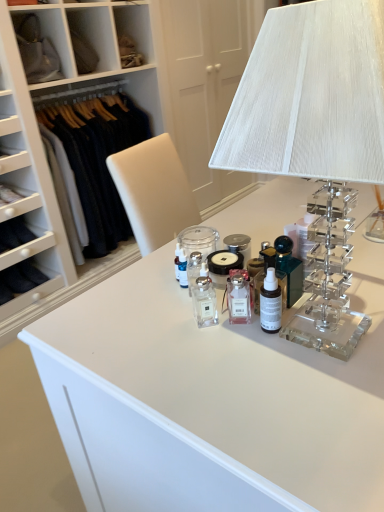
Question: From their relative heights in the image, would you say clear glass bottle at center, the 1th toiletry from the left, is taller or shorter than dark wool sweater at left?

Choices:
 (A) tall
 (B) short

Answer: (B)

Question: Considering the positions of clear glass bottle at center, which ranks as the 2th toiletry in right-to-left order, and dark wool sweater at left in the image, is clear glass bottle at center, which ranks as the 2th toiletry in right-to-left order, bigger or smaller than dark wool sweater at left?

Choices:
 (A) big
 (B) small

Answer: (B)

Question: Which of these objects is positioned farthest from the satin black bottle at center, the first toiletry positioned from the right?

Choices:
 (A) clear acrylic table lamp at upper right
 (B) dark wool sweater at left
 (C) clear glass bottle at center, the 1th toiletry from the left

Answer: (B)

Question: Based on their relative distances, which object is nearer to the dark wool sweater at left?

Choices:
 (A) clear acrylic table lamp at upper right
 (B) satin black bottle at center, which is counted as the 2th toiletry, starting from the left
 (C) clear glass bottle at center, which ranks as the 2th toiletry in right-to-left order

Answer: (C)